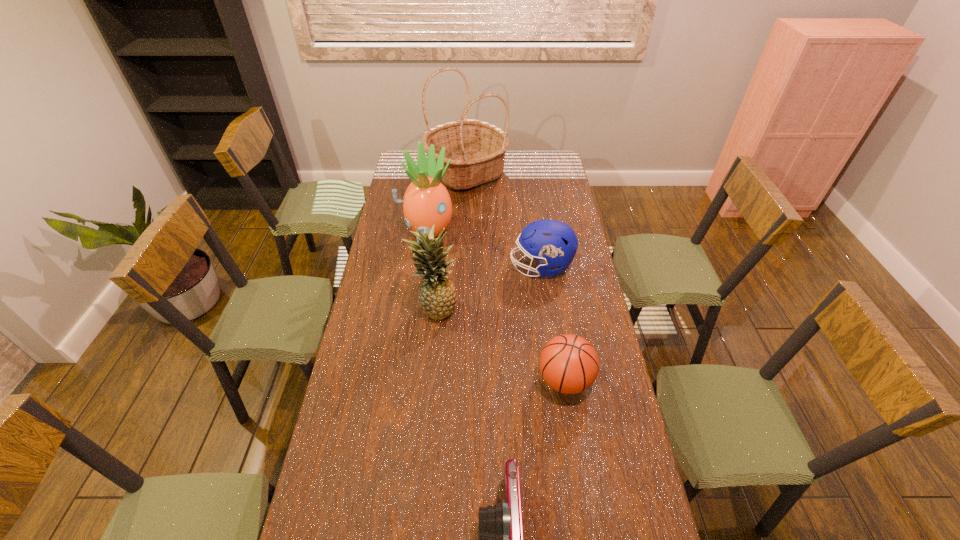
In order to click on free space located on the back of the nearer pineapple in this screenshot , I will do `click(441, 261)`.

Image resolution: width=960 pixels, height=540 pixels. Find the location of `vacant space located on the front-facing side of the fourth tallest object`. vacant space located on the front-facing side of the fourth tallest object is located at coordinates (428, 267).

I want to click on vacant space situated on the front-facing side of the fourth tallest object, so click(x=447, y=267).

Find the location of a particular element. Image resolution: width=960 pixels, height=540 pixels. vacant space positioned 0.110m on the front-facing side of the fourth tallest object is located at coordinates [483, 267].

Locate an element on the screen. The height and width of the screenshot is (540, 960). vacant space located on the left of the basketball is located at coordinates (437, 380).

Image resolution: width=960 pixels, height=540 pixels. I want to click on object present at the far edge, so click(x=476, y=148).

At what (x,y) coordinates should I click in order to perform the action: click on basket situated at the left edge. Please return your answer as a coordinate pair (x, y). The height and width of the screenshot is (540, 960). Looking at the image, I should click on (476, 148).

Where is `pineapple positioned at the left edge`? pineapple positioned at the left edge is located at coordinates (426, 201).

I want to click on football helmet present at the right edge, so click(552, 243).

Image resolution: width=960 pixels, height=540 pixels. I want to click on basketball located in the right edge section of the desktop, so click(x=569, y=364).